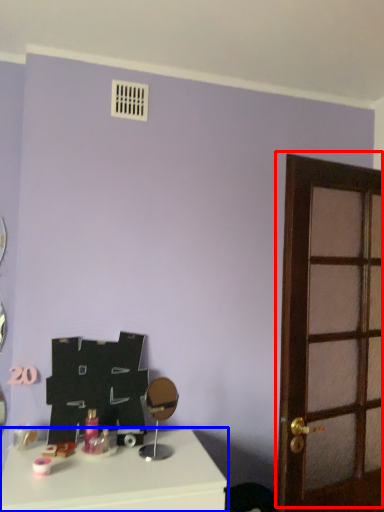
Question: Which object is closer to the camera taking this photo, door (highlighted by a red box) or table (highlighted by a blue box)?

Choices:
 (A) door
 (B) table

Answer: (B)